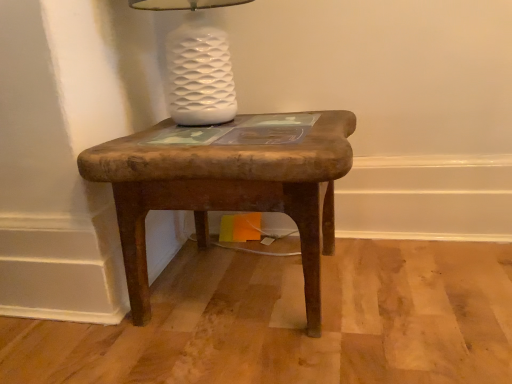
In order to click on free location above rustic wood stool at center (from a real-world perspective) in this screenshot , I will do `click(234, 131)`.